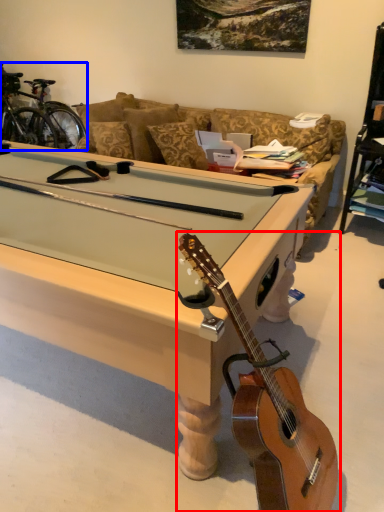
Question: Which of the following is the closest to the observer, guitar (highlighted by a red box) or bicycle (highlighted by a blue box)?

Choices:
 (A) guitar
 (B) bicycle

Answer: (A)